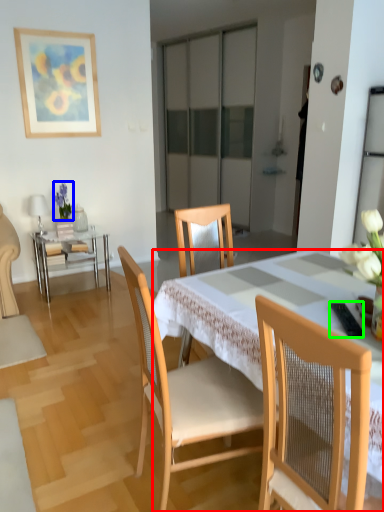
Question: Based on their relative distances, which object is nearer to desk (highlighted by a red box)? Choose from floral arrangement (highlighted by a blue box) and remote control (highlighted by a green box).

Choices:
 (A) floral arrangement
 (B) remote control

Answer: (B)